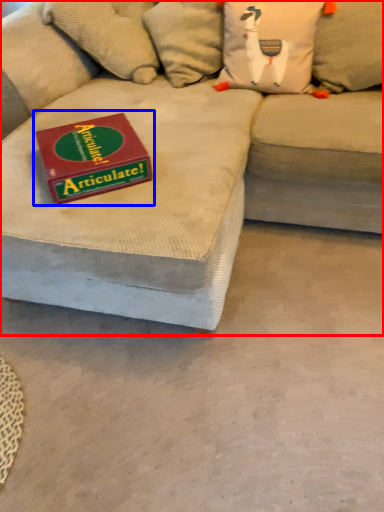
Question: Which object appears closest to the camera in this image, studio couch (highlighted by a red box) or paperback book (highlighted by a blue box)?

Choices:
 (A) studio couch
 (B) paperback book

Answer: (A)